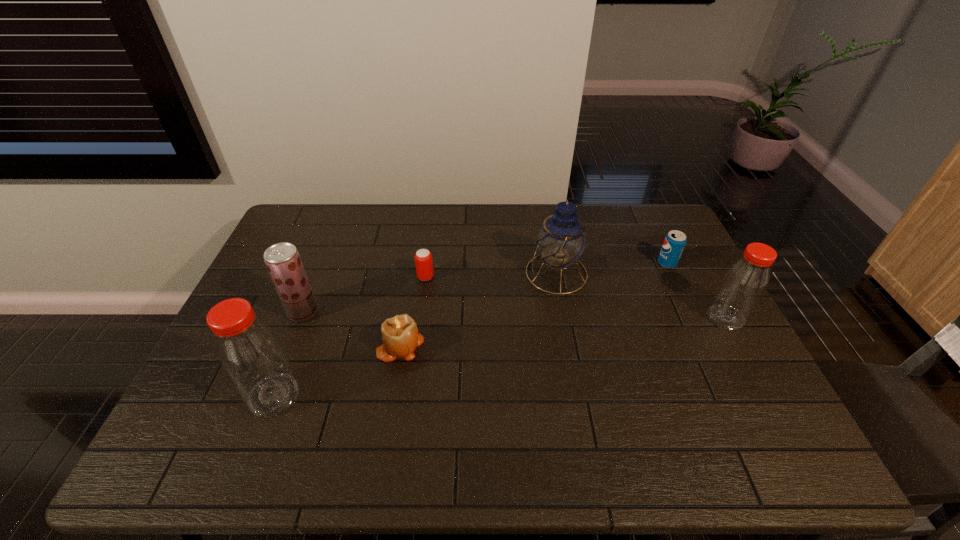
This screenshot has height=540, width=960. I want to click on vacant space in between the candle and the shortest object, so click(413, 311).

This screenshot has height=540, width=960. In order to click on free spot between the fruit juice and the soda can in this screenshot , I will do [x=485, y=288].

Where is `vacant area that lies between the left bottle and the soda can`? The height and width of the screenshot is (540, 960). vacant area that lies between the left bottle and the soda can is located at coordinates (470, 329).

Find the location of a particular element. The height and width of the screenshot is (540, 960). empty location between the fruit juice and the third object from right to left is located at coordinates (430, 293).

Where is `free space between the candle and the farther bottle`? free space between the candle and the farther bottle is located at coordinates (563, 332).

This screenshot has height=540, width=960. What are the coordinates of `free spot between the beer can and the soda can` in the screenshot? It's located at (546, 270).

Locate an element on the screen. This screenshot has height=540, width=960. vacant area that lies between the soda can and the taller bottle is located at coordinates (470, 329).

I want to click on object that stands as the third closest to the second object from right to left, so click(423, 258).

Locate an element on the screen. The image size is (960, 540). object that is the fourth nearest to the shorter bottle is located at coordinates (400, 336).

Where is `vacant region that satisfies the following two spatial constraints: 1. on the back side of the candle; 2. on the right side of the second object from right to left`? vacant region that satisfies the following two spatial constraints: 1. on the back side of the candle; 2. on the right side of the second object from right to left is located at coordinates (414, 264).